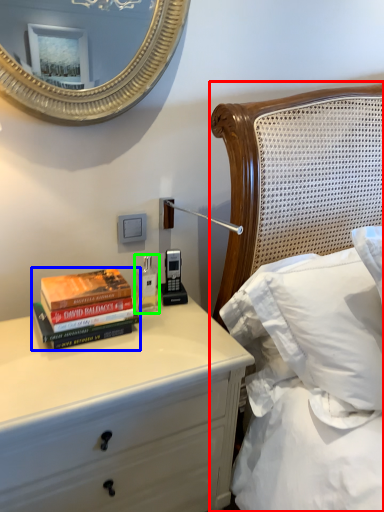
Question: Based on their relative distances, which object is nearer to bed (highlighted by a red box)? Choose from book (highlighted by a blue box) and bottle (highlighted by a green box).

Choices:
 (A) book
 (B) bottle

Answer: (B)